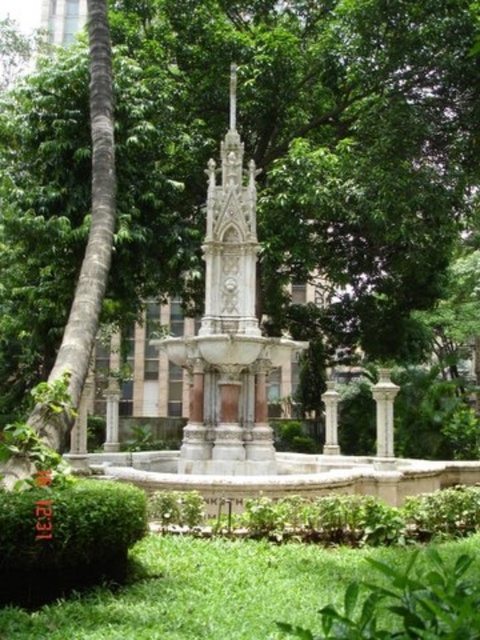
You are standing in the park and want to take a photo of the white marble column at lower right and the white stone column at center. Which column should you focus on first if you want to capture both in your camera frame?

You should focus on the white stone column at center first because the white marble column at lower right is above it, so adjusting the frame to include the lower column might require a wider angle or repositioning to ensure both are visible.

You are standing at the center of the park and want to locate the white marble column at lower right. Which direction should you face to see it?

The white marble column at lower right is located at point (384, 412), so you should face towards the lower right direction to see it.

You are a maintenance worker needing to replace a broken pipe connecting the white marble column at lower right and the white stone column at center. The pipe you have is 12 meters long. Is the pipe long enough to connect the two columns?

The distance between the white marble column at lower right and the white stone column at center is 13.22 meters, so the 12 meter pipe is not long enough to connect them. A longer pipe is required.